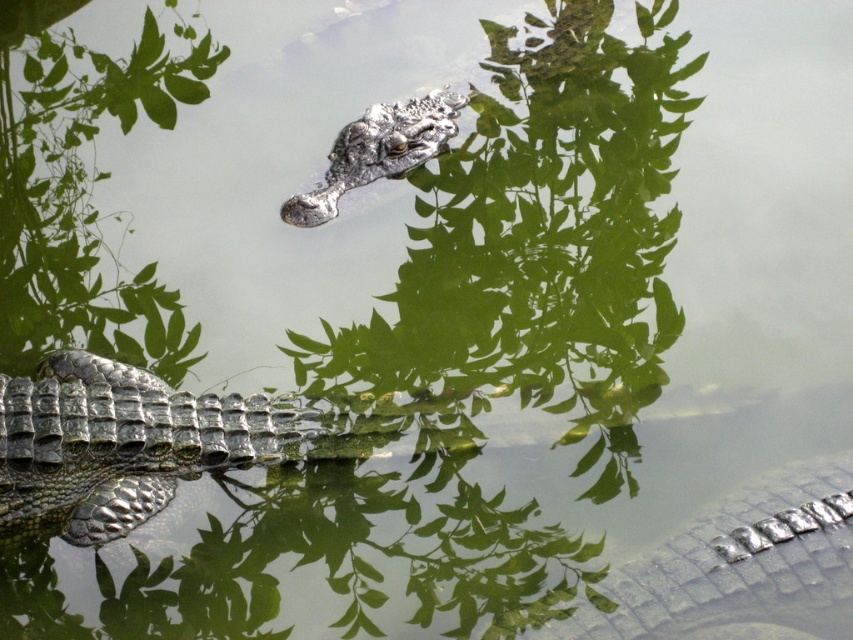
You are observing the crocodile in the water. Where exactly are the shiny green scales at lower right positioned in relation to the crocodile?

The shiny green scales at lower right are positioned at point coordinates of approximately 0.887 on the x axis and 0.868 on the y axis.

You are a wildlife photographer aiming to capture the reflection of the green scaly crocodile at lower left in the water. The camera is set to focus on objects at point 0.692 on the horizontal axis and 0.142 on the vertical axis. Will the reflection of the crocodile be visible in the water?

The green scaly crocodile at lower left is positioned at point [120,442]. Since water surfaces can reflect objects above them, the reflection should be visible at the same coordinates but mirrored vertically. Therefore, the reflection should be visible in the water.

You are an observer standing at the edge of the water. You see the shiny metallic crocodile at center and the shiny green scales at lower right. Which object is positioned farther to the right from your perspective?

The shiny green scales at lower right is positioned farther to the right than the shiny metallic crocodile at center.